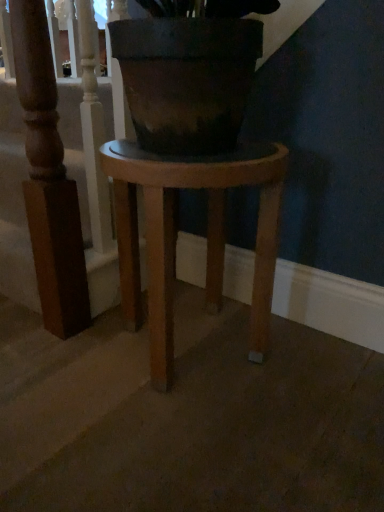
Locate an element on the screen. The height and width of the screenshot is (512, 384). vacant space underneath wooden stool at center (from a real-world perspective) is located at coordinates (195, 345).